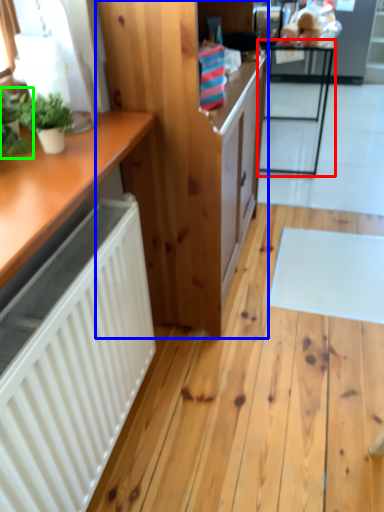
Question: Estimate the real-world distances between objects in this image. Which object is closer to table (highlighted by a red box), cabinetry (highlighted by a blue box) or houseplant (highlighted by a green box)?

Choices:
 (A) cabinetry
 (B) houseplant

Answer: (A)